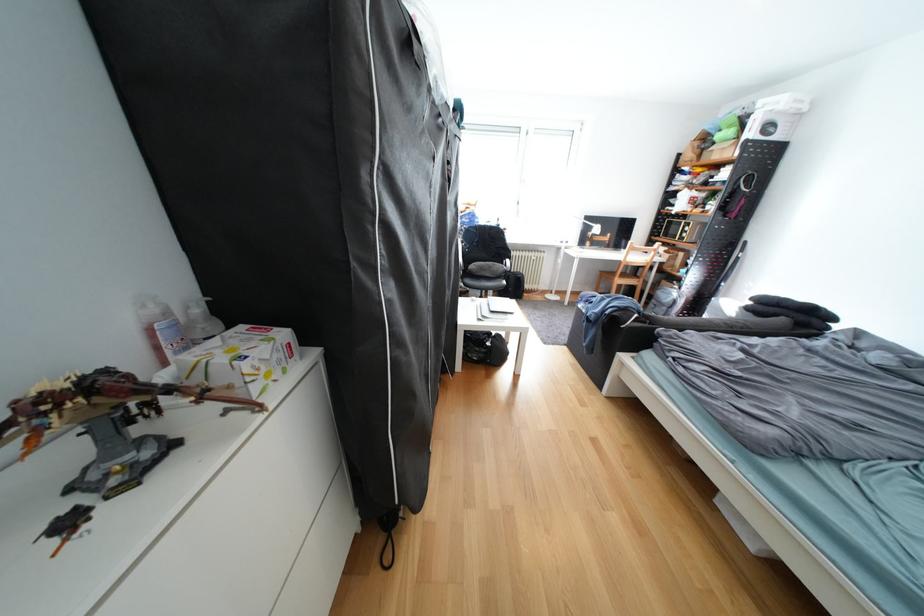
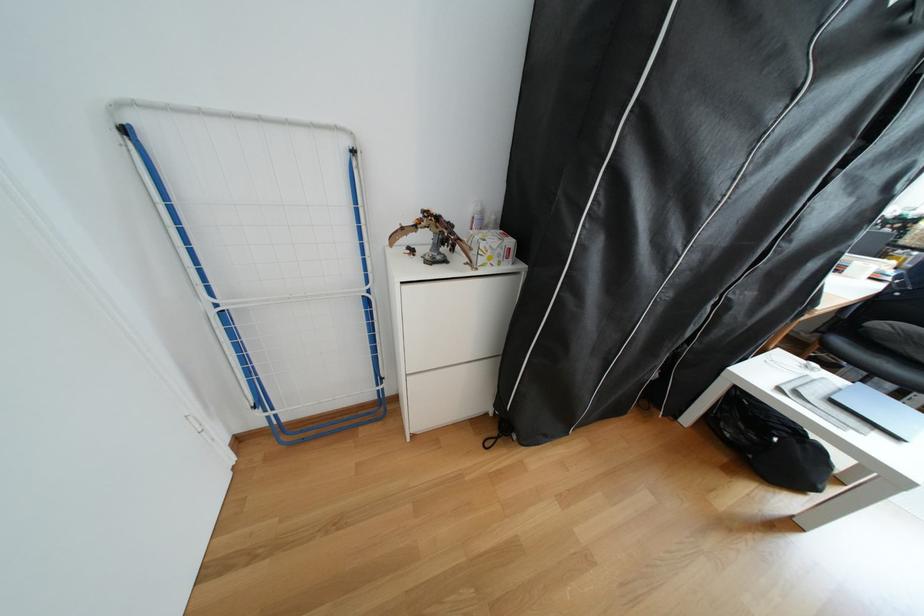
Question: I am providing you with two images of the same scene from different viewpoints. Which of the following objects are not visible in image2?

Choices:
 (A) closed grey laptop
 (B) white tissue box
 (C) dragon figurine
 (D) none of these

Answer: (D)